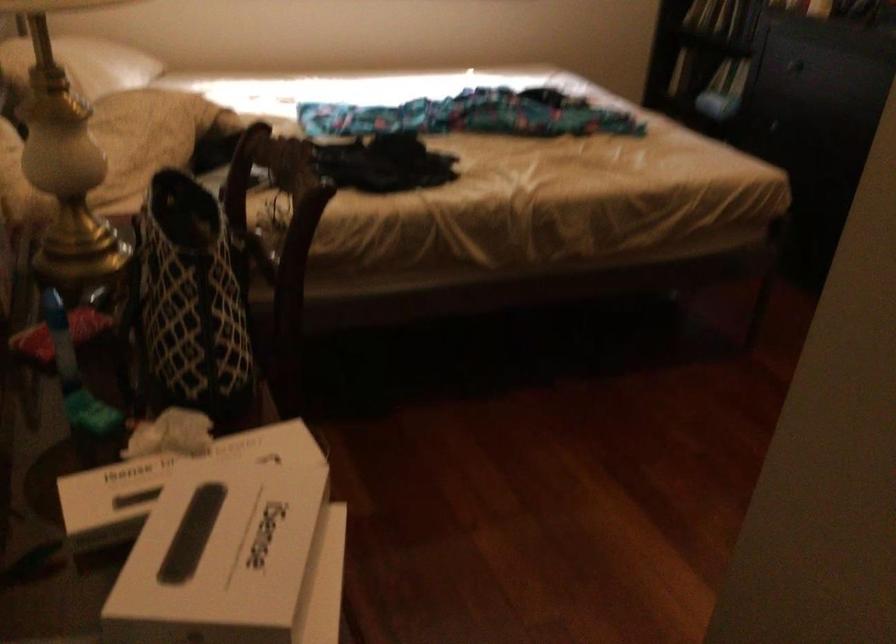
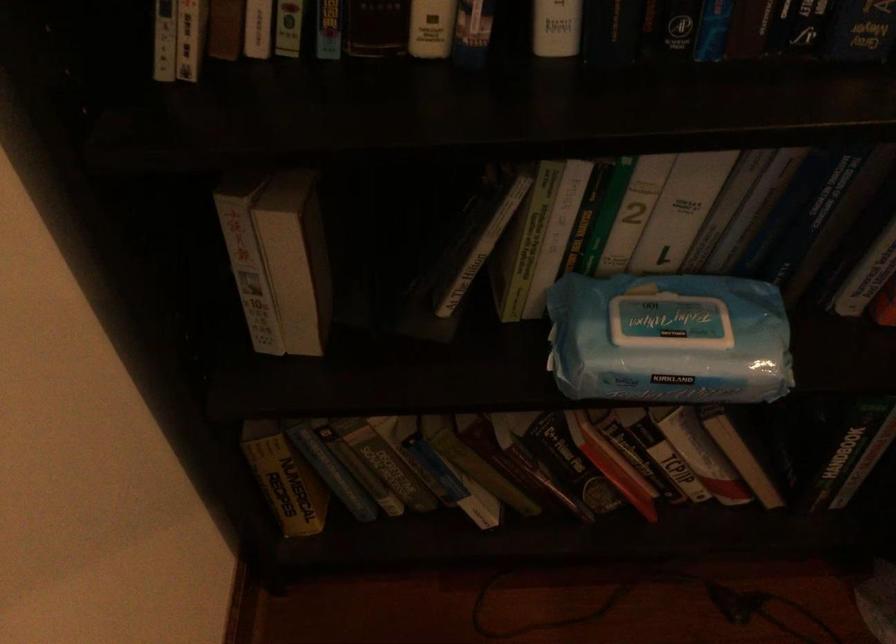
The point at (666, 114) is marked in the first image. Where is the corresponding point in the second image?

(285, 478)